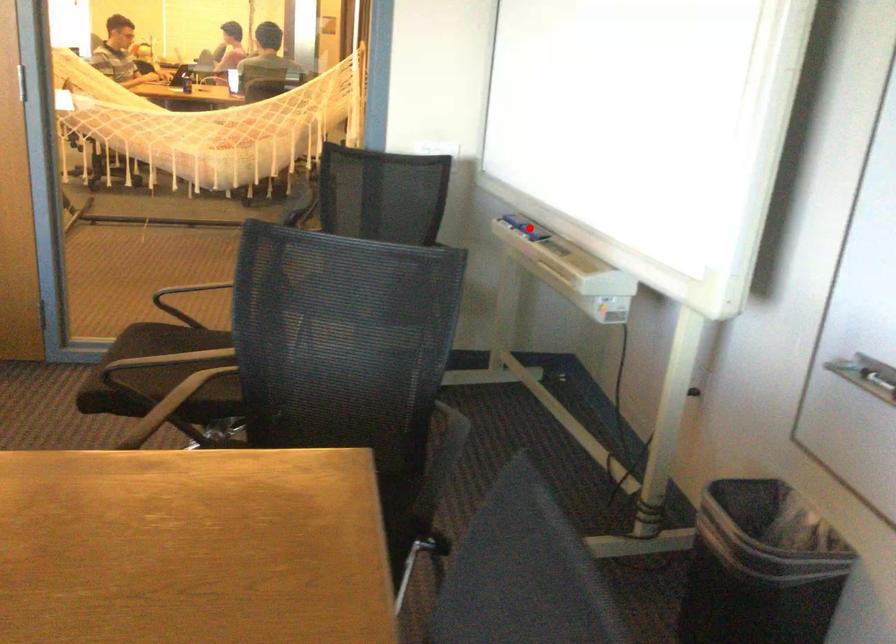
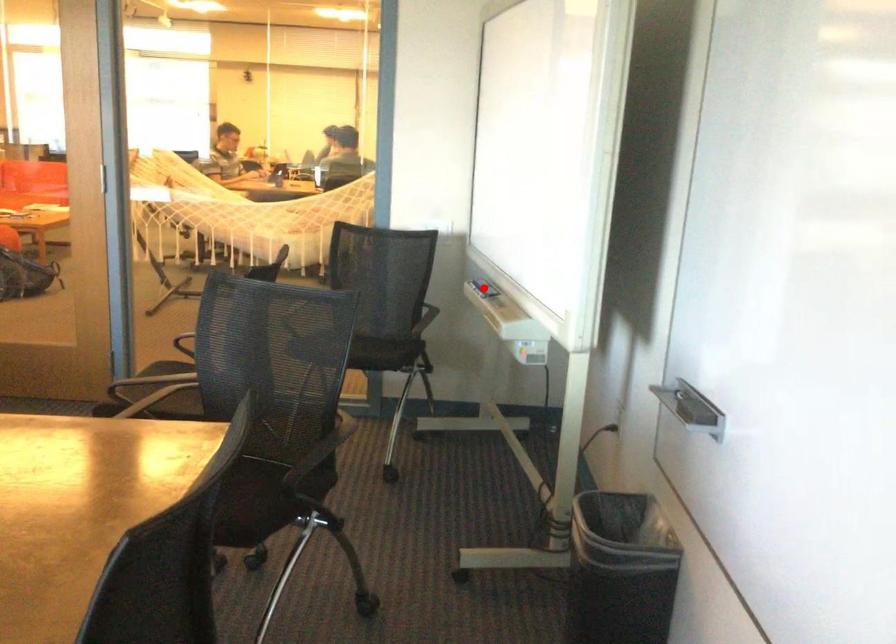
I am providing you with two images of the same scene from different viewpoints. A red point is marked on the first image and another point is marked on the second image. Are the points marked in image1 and image2 representing the same 3D position?

Yes